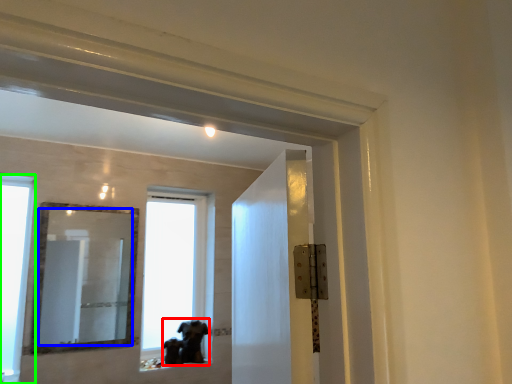
Question: Which object is positioned closest to animal (highlighted by a red box)? Select from mirror (highlighted by a blue box) and window (highlighted by a green box).

Choices:
 (A) mirror
 (B) window

Answer: (B)